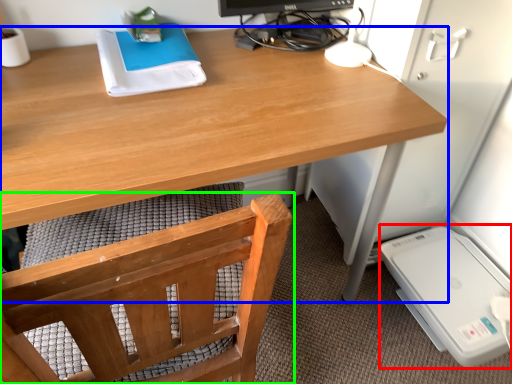
Question: Based on their relative distances, which object is nearer to appliance (highlighted by a red box)? Choose from desk (highlighted by a blue box) and chair (highlighted by a green box).

Choices:
 (A) desk
 (B) chair

Answer: (A)